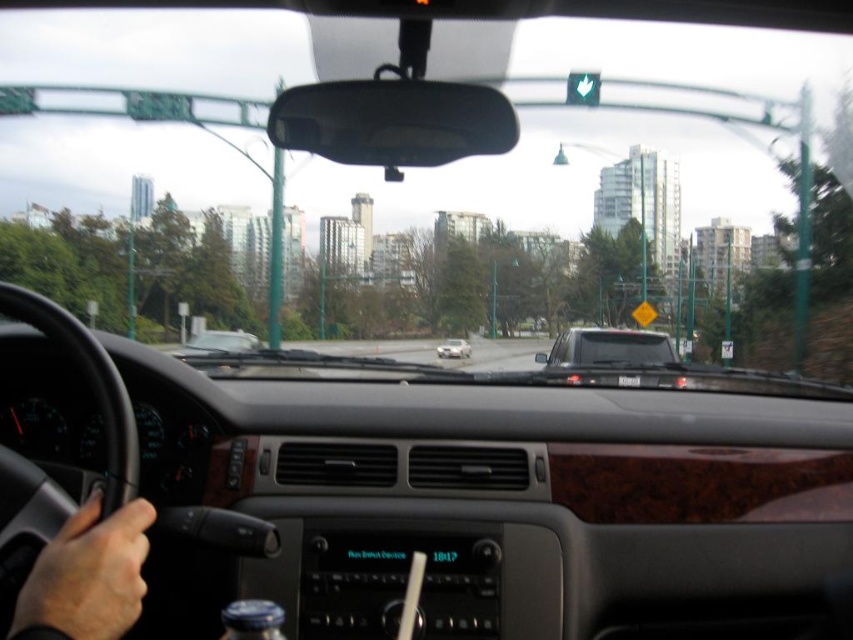
Can you confirm if matte black car at center is positioned to the right of green matte traffic light at upper center?

Correct, you'll find matte black car at center to the right of green matte traffic light at upper center.

Who is more forward, (x=625, y=364) or (x=570, y=80)?

Positioned in front is point (x=625, y=364).

Between point (573, 330) and point (583, 99), which one is positioned behind?

The point (583, 99) is more distant.

Locate an element on the screen. Image resolution: width=853 pixels, height=640 pixels. matte black car at center is located at coordinates (608, 348).

Can you confirm if smooth skin hand at lower left is positioned to the right of matte black car at center?

No, smooth skin hand at lower left is not to the right of matte black car at center.

In the scene shown: Does smooth skin hand at lower left come behind matte black car at center?

No, smooth skin hand at lower left is closer to the viewer.

The height and width of the screenshot is (640, 853). What do you see at coordinates (86, 577) in the screenshot? I see `smooth skin hand at lower left` at bounding box center [86, 577].

The image size is (853, 640). I want to click on smooth skin hand at lower left, so click(x=86, y=577).

Between smooth skin hand at lower left and satin silver sedan at center, which one has more height?

satin silver sedan at center

Who is more forward, (73, 536) or (457, 356)?

Positioned in front is point (73, 536).

You are a GUI agent. You are given a task and a screenshot of the screen. Output one action in this format:
    pyautogui.click(x=<x>, y=<y>)
    Task: Click on the smooth skin hand at lower left
    
    Given the screenshot: What is the action you would take?
    pyautogui.click(x=86, y=577)